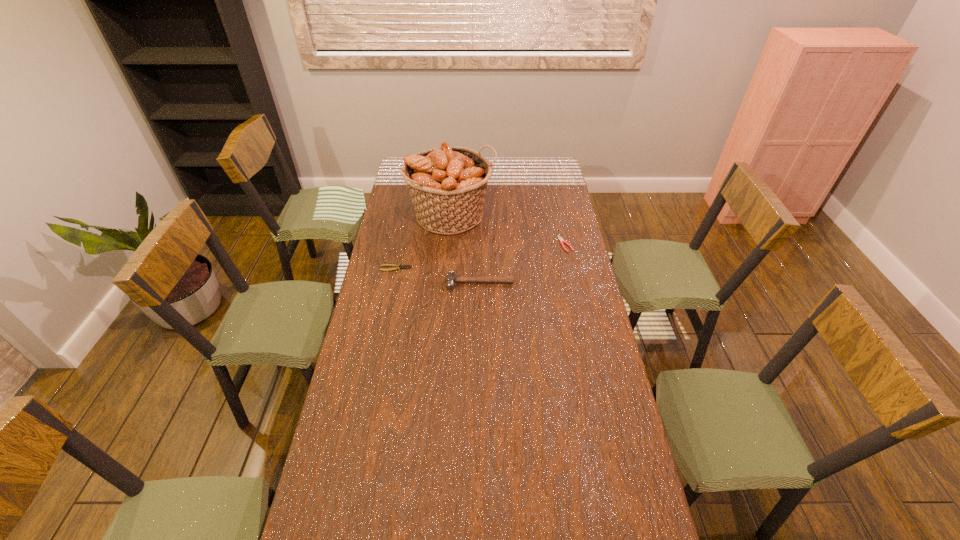
Image resolution: width=960 pixels, height=540 pixels. In order to click on basket in this screenshot , I will do `click(447, 184)`.

The height and width of the screenshot is (540, 960). In order to click on hammer in this screenshot , I will do `click(450, 278)`.

The height and width of the screenshot is (540, 960). I want to click on the nearest object, so click(450, 278).

You are a GUI agent. You are given a task and a screenshot of the screen. Output one action in this format:
    pyautogui.click(x=<x>, y=<y>)
    Task: Click on the rightmost object
    The image size is (960, 540).
    Given the screenshot: What is the action you would take?
    pyautogui.click(x=562, y=241)

The image size is (960, 540). What are the coordinates of `the farther pliers` in the screenshot? It's located at (562, 241).

Find the location of a particular element. Image resolution: width=960 pixels, height=540 pixels. the nearer pliers is located at coordinates (396, 267).

At what (x,y) coordinates should I click in order to perform the action: click on the third farthest object. Please return your answer as a coordinate pair (x, y). This screenshot has height=540, width=960. Looking at the image, I should click on (396, 267).

You are a GUI agent. You are given a task and a screenshot of the screen. Output one action in this format:
    pyautogui.click(x=<x>, y=<y>)
    Task: Click on the vacant space located on the back of the tallest object
    The width and height of the screenshot is (960, 540).
    Given the screenshot: What is the action you would take?
    pyautogui.click(x=455, y=177)

You are a GUI agent. You are given a task and a screenshot of the screen. Output one action in this format:
    pyautogui.click(x=<x>, y=<y>)
    Task: Click on the free spot located 0.060m on the striking face of the nearest object
    The image size is (960, 540).
    Given the screenshot: What is the action you would take?
    pyautogui.click(x=480, y=302)

The height and width of the screenshot is (540, 960). I want to click on vacant space situated 0.320m on the back of the right pliers, so click(x=555, y=197).